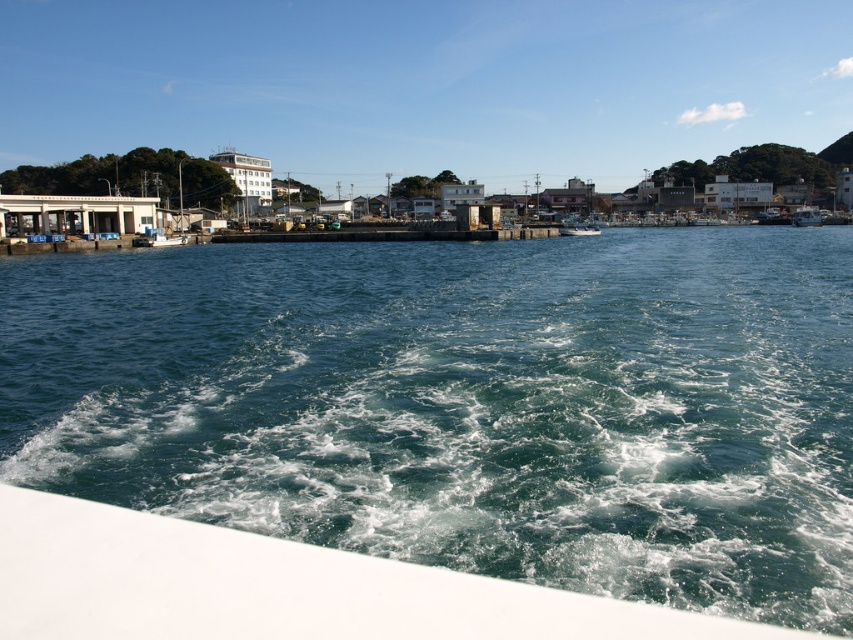
Is green water at center wider than white matte boat at lower left?

Yes.

Can you confirm if green water at center is shorter than white matte boat at lower left?

No.

Is point (175, 488) less distant than point (213, 634)?

No, (175, 488) is further to viewer.

I want to click on green water at center, so click(x=466, y=404).

Between white matte boat at lower left and white plastic boat at right, which one appears on the right side from the viewer's perspective?

white plastic boat at right is more to the right.

Which is below, white matte boat at lower left or white plastic boat at right?

white matte boat at lower left is below.

Describe the element at coordinates (276, 586) in the screenshot. This screenshot has height=640, width=853. I see `white matte boat at lower left` at that location.

The image size is (853, 640). Find the location of `white matte boat at lower left`. white matte boat at lower left is located at coordinates 276,586.

Which of these two, green water at center or white plastic boat at right, stands taller?

With more height is white plastic boat at right.

In the scene shown: Is green water at center shorter than white plastic boat at right?

Yes.

Who is more forward, (184, 445) or (796, 225)?

Point (184, 445)

At what (x,y) coordinates should I click in order to perform the action: click on green water at center. Please return your answer as a coordinate pair (x, y). Looking at the image, I should click on (466, 404).